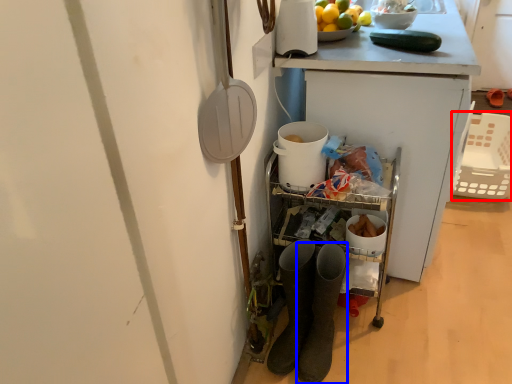
Question: Among these objects, which one is nearest to the camera, basket (highlighted by a red box) or footwear (highlighted by a blue box)?

Choices:
 (A) basket
 (B) footwear

Answer: (B)